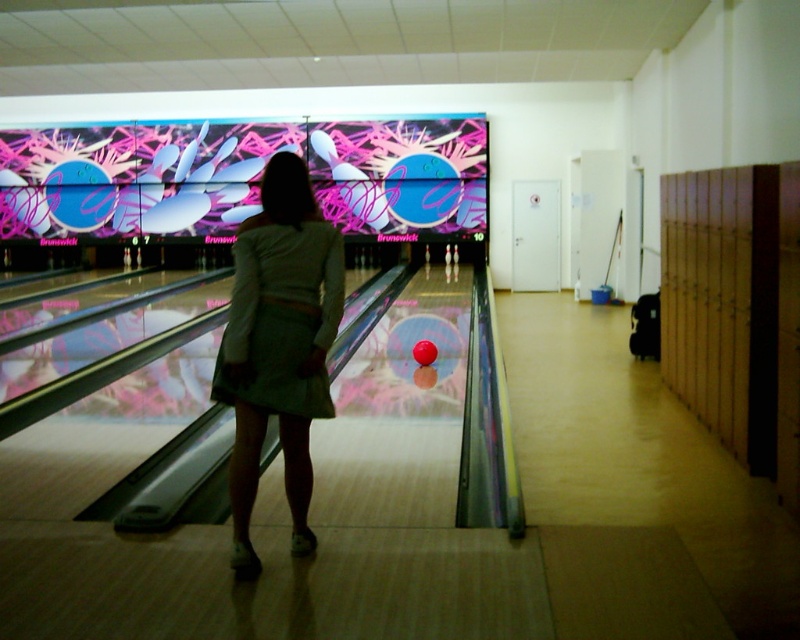
Does point (256, 486) come closer to viewer compared to point (428, 346)?

Yes, it is.

Between point (332, 412) and point (429, 348), which one is positioned behind?

Positioned behind is point (429, 348).

Find the location of `white cotton dress at center`. white cotton dress at center is located at coordinates (278, 344).

This screenshot has height=640, width=800. Find the location of `white cotton dress at center`. white cotton dress at center is located at coordinates pos(278,344).

Does white cotton dress at center have a larger size compared to green fabric dress at center?

Yes.

Locate an element on the screen. The image size is (800, 640). white cotton dress at center is located at coordinates (278, 344).

What are the coordinates of `white cotton dress at center` in the screenshot? It's located at (278, 344).

Which is more to the right, green fabric dress at center or matte red bowling ball at center?

Positioned to the right is matte red bowling ball at center.

Can you confirm if green fabric dress at center is positioned to the right of matte red bowling ball at center?

In fact, green fabric dress at center is to the left of matte red bowling ball at center.

This screenshot has height=640, width=800. What do you see at coordinates (281, 316) in the screenshot?
I see `green fabric dress at center` at bounding box center [281, 316].

Where is `green fabric dress at center`? Image resolution: width=800 pixels, height=640 pixels. green fabric dress at center is located at coordinates (281, 316).